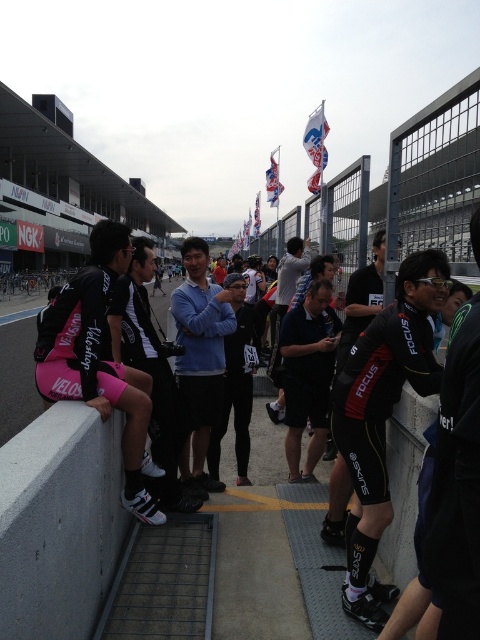
Question: Does black matte cycling suit at center appear on the right side of pink fabric shorts at left?

Choices:
 (A) no
 (B) yes

Answer: (B)

Question: From the image, what is the correct spatial relationship of black matte cycling suit at center in relation to pink fabric shorts at left?

Choices:
 (A) above
 (B) below

Answer: (B)

Question: Among these objects, which one is nearest to the camera?

Choices:
 (A) black matte cycling suit at center
 (B) pink fabric shorts at left

Answer: (A)

Question: Which point is farther to the camera?

Choices:
 (A) (368, 416)
 (B) (51, 378)

Answer: (B)

Question: In this image, where is black matte cycling suit at center located relative to pink fabric shorts at left?

Choices:
 (A) right
 (B) left

Answer: (A)